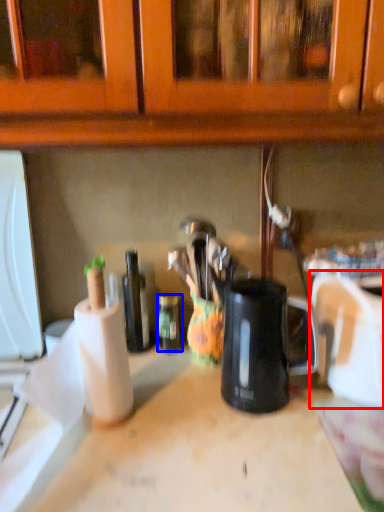
Question: Which of the following is the farthest to the observer, appliance (highlighted by a red box) or bottle (highlighted by a blue box)?

Choices:
 (A) appliance
 (B) bottle

Answer: (B)